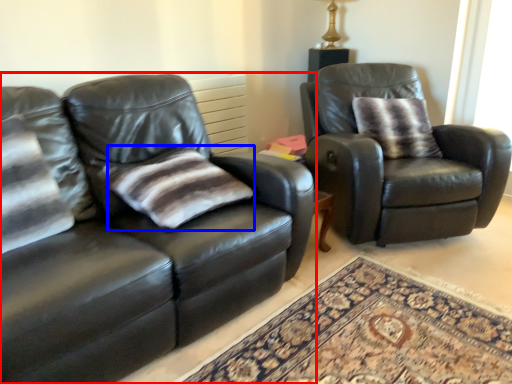
Question: Which object appears farthest to the camera in this image, studio couch (highlighted by a red box) or pillow (highlighted by a blue box)?

Choices:
 (A) studio couch
 (B) pillow

Answer: (B)